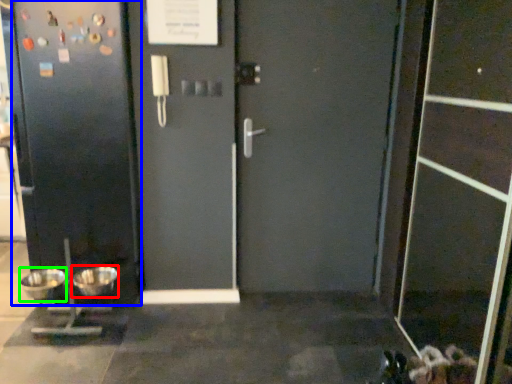
Question: Which object is the farthest from mixing bowl (highlighted by a red box)? Choose among these: door (highlighted by a blue box) or mixing bowl (highlighted by a green box).

Choices:
 (A) door
 (B) mixing bowl

Answer: (A)